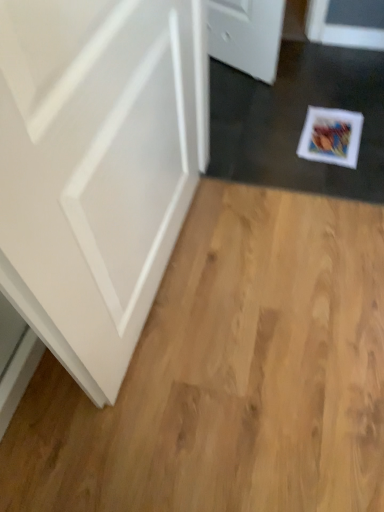
In order to face white matte card game at lower right, should I rotate leftwards or rightwards?

Turn right by 18.245 degrees to look at white matte card game at lower right.

The width and height of the screenshot is (384, 512). I want to click on white matte card game at lower right, so click(331, 136).

The width and height of the screenshot is (384, 512). What do you see at coordinates (331, 136) in the screenshot? I see `white matte card game at lower right` at bounding box center [331, 136].

Where is `white matte card game at lower right`? The width and height of the screenshot is (384, 512). white matte card game at lower right is located at coordinates (331, 136).